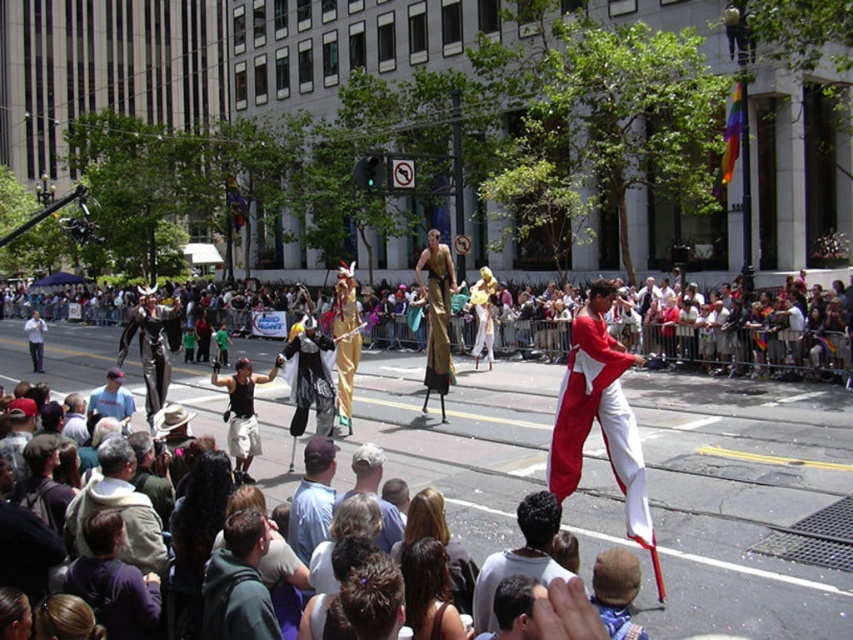
Question: Can you confirm if dark brown leather jacket at lower left is positioned above dark brown hair at lower center?

Choices:
 (A) yes
 (B) no

Answer: (B)

Question: Among these points, which one is nearest to the camera?

Choices:
 (A) (131, 524)
 (B) (358, 470)

Answer: (A)

Question: Does gold metallic statue at center appear under light blue cotton shirt at center?

Choices:
 (A) yes
 (B) no

Answer: (B)

Question: Which object appears closest to the camera in this image?

Choices:
 (A) dark gray hoodie at lower left
 (B) shiny black costume at center

Answer: (A)

Question: Which of the following is the closest to the observer?

Choices:
 (A) white cotton shirt at center
 (B) gold metallic statue at center
 (C) dark brown hair at lower center
 (D) shiny black costume at center

Answer: (C)

Question: Does matte red and white pants at center lie behind dark green hoodie at lower left?

Choices:
 (A) no
 (B) yes

Answer: (B)